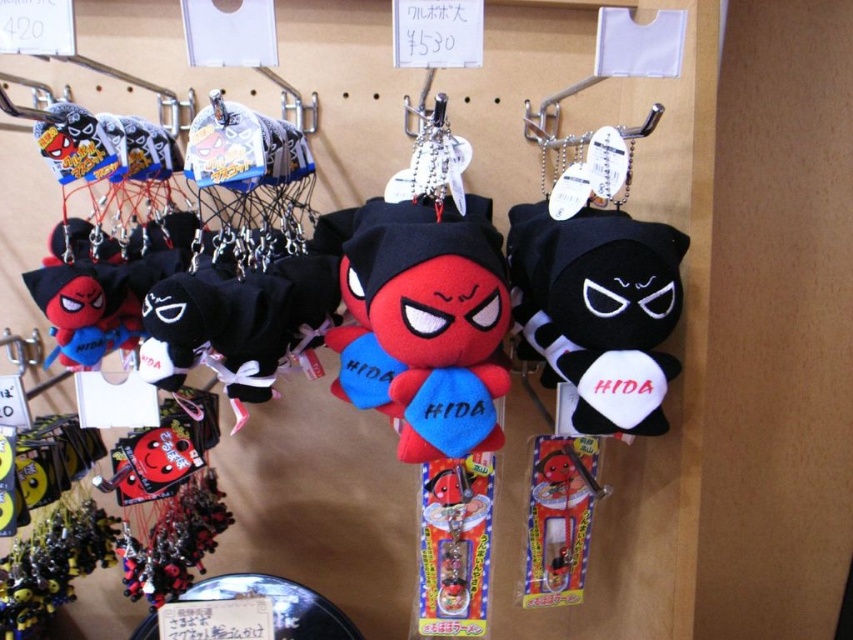
You are a customer looking at the display of plush keychains. Where exactly is the matte plush toy at center located on the pegboard wall?

The matte plush toy at center is located at point coordinates of (422, 323) on the pegboard wall.